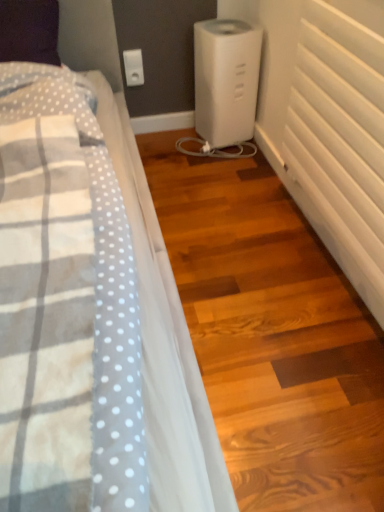
Question: Considering the positions of white matte radiator at right and white plastic humidifier at center in the image, is white matte radiator at right bigger or smaller than white plastic humidifier at center?

Choices:
 (A) big
 (B) small

Answer: (A)

Question: Visually, is white matte radiator at right positioned to the left or to the right of white plastic humidifier at center?

Choices:
 (A) left
 (B) right

Answer: (B)

Question: Which object is the farthest from the white plastic humidifier at center?

Choices:
 (A) white matte radiator at right
 (B) white plastic electric outlet at upper center

Answer: (A)

Question: Which of these objects is positioned closest to the white plastic electric outlet at upper center?

Choices:
 (A) white plastic humidifier at center
 (B) white matte radiator at right

Answer: (A)